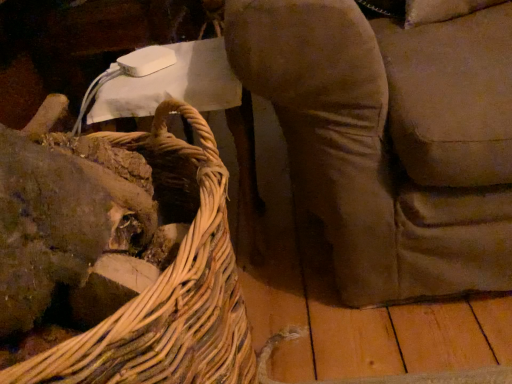
Question: From their relative heights in the image, would you say woven wood picnic basket at left is taller or shorter than velvet brown armchair at center?

Choices:
 (A) short
 (B) tall

Answer: (B)

Question: Considering the positions of point (56, 362) and point (331, 26), is point (56, 362) closer or farther from the camera than point (331, 26)?

Choices:
 (A) farther
 (B) closer

Answer: (B)

Question: From the image's perspective, is woven wood picnic basket at left above or below velvet brown armchair at center?

Choices:
 (A) below
 (B) above

Answer: (A)

Question: Is velvet brown armchair at center taller or shorter than woven wood picnic basket at left?

Choices:
 (A) tall
 (B) short

Answer: (B)

Question: From the image's perspective, relative to woven wood picnic basket at left, is velvet brown armchair at center above or below?

Choices:
 (A) below
 (B) above

Answer: (B)

Question: Relative to woven wood picnic basket at left, is velvet brown armchair at center in front or behind?

Choices:
 (A) front
 (B) behind

Answer: (B)

Question: Is velvet brown armchair at center inside the boundaries of woven wood picnic basket at left, or outside?

Choices:
 (A) inside
 (B) outside

Answer: (B)